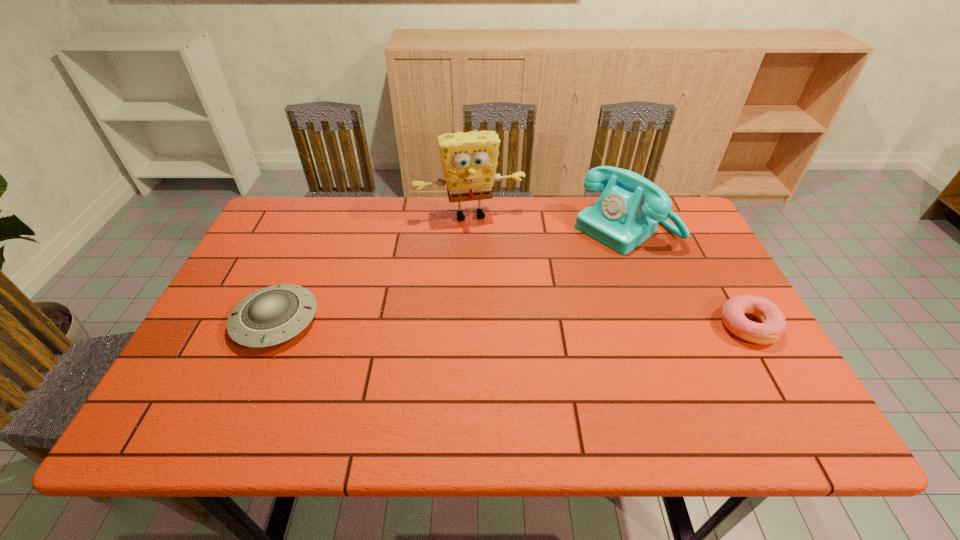
You are a GUI agent. You are given a task and a screenshot of the screen. Output one action in this format:
    pyautogui.click(x=<x>, y=<y>)
    Task: Click on the free spot located 0.370m on the dial of the second tallest object
    Image resolution: width=960 pixels, height=540 pixels.
    Given the screenshot: What is the action you would take?
    pyautogui.click(x=502, y=310)

Where is `vacant space positioned on the dial of the second tallest object`? The image size is (960, 540). vacant space positioned on the dial of the second tallest object is located at coordinates (493, 316).

The image size is (960, 540). What are the coordinates of `free space located 0.310m on the dial of the second tallest object` in the screenshot? It's located at (518, 298).

The width and height of the screenshot is (960, 540). Find the location of `sponge present at the far edge`. sponge present at the far edge is located at coordinates (469, 160).

Identify the location of telephone at the far edge. (629, 209).

Locate an element on the screen. object that is at the left edge is located at coordinates (272, 315).

Find the location of `doughnut that is at the right edge`. doughnut that is at the right edge is located at coordinates (773, 325).

Where is `telephone that is at the right edge`? telephone that is at the right edge is located at coordinates (629, 209).

What are the coordinates of `object that is at the far right corner` in the screenshot? It's located at pyautogui.click(x=629, y=209).

Where is `free space at the far edge of the desktop`? free space at the far edge of the desktop is located at coordinates (514, 208).